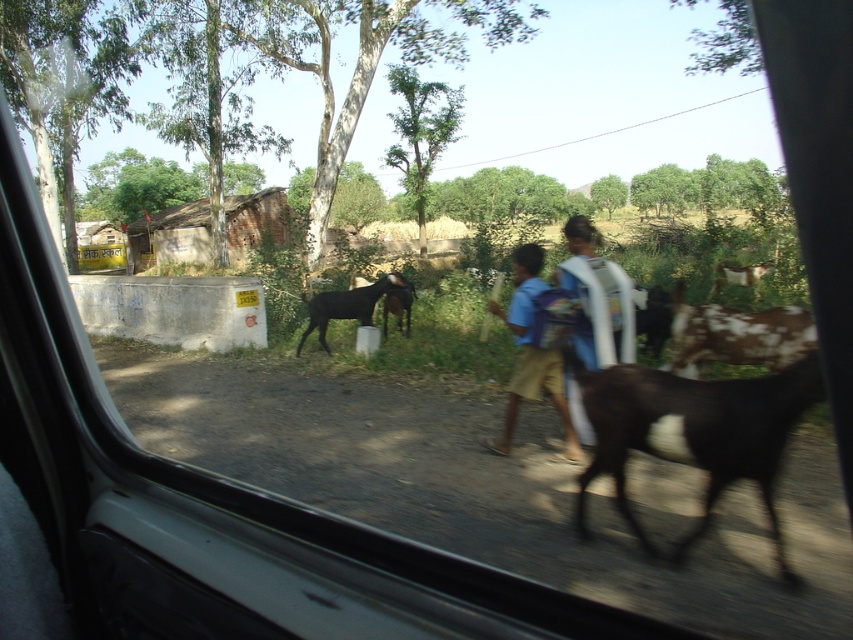
Question: Among these objects, which one is farthest from the camera?

Choices:
 (A) blue cotton shirt at center
 (B) black fur goat at center

Answer: (B)

Question: Is the position of black fur goat at right less distant than that of black fur goat at center?

Choices:
 (A) yes
 (B) no

Answer: (A)

Question: Which of the following is the closest to the observer?

Choices:
 (A) black fur goat at right
 (B) blue cotton shirt at center
 (C) black glossy goat at center
 (D) black fur goat at center

Answer: (A)

Question: Does blue cotton shirt at center appear under black fur goat at center?

Choices:
 (A) no
 (B) yes

Answer: (B)

Question: Which point appears farthest from the camera in this image?

Choices:
 (A) (408, 307)
 (B) (616, 371)
 (C) (398, 285)

Answer: (A)

Question: Is blue cotton shirt at center bigger than black fur goat at center?

Choices:
 (A) yes
 (B) no

Answer: (A)